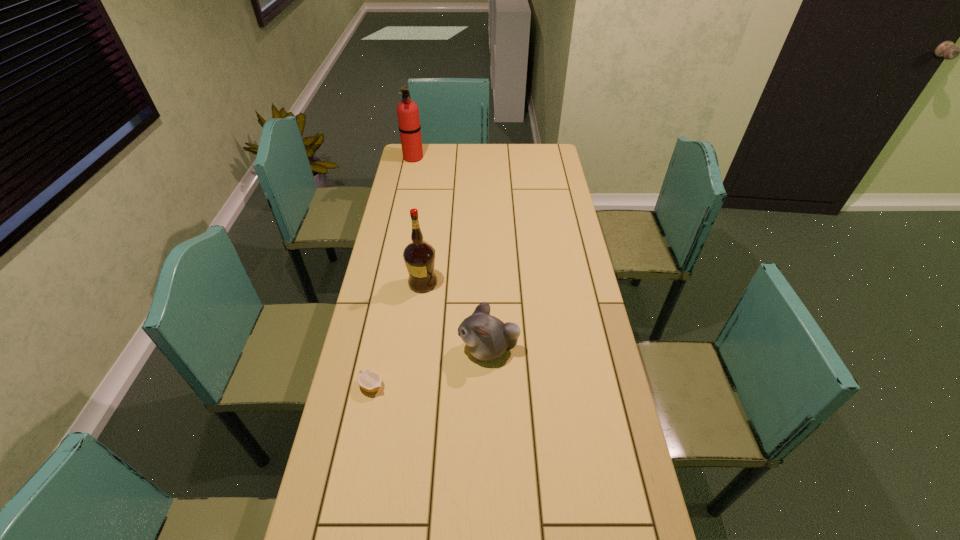
The width and height of the screenshot is (960, 540). I want to click on vacant area at the right edge of the desktop, so click(x=551, y=170).

I want to click on vacant space at the far left corner of the desktop, so click(429, 151).

Locate an element on the screen. The image size is (960, 540). free location at the far right corner of the desktop is located at coordinates pyautogui.click(x=536, y=148).

The width and height of the screenshot is (960, 540). I want to click on free space between the farthest object and the hamster, so click(451, 253).

Image resolution: width=960 pixels, height=540 pixels. I want to click on vacant point located between the second farthest object and the second nearest object, so click(456, 316).

This screenshot has width=960, height=540. I want to click on vacant area between the alcohol and the lemon, so click(397, 334).

In order to click on vacant point located between the alcohol and the nearest object in this screenshot , I will do `click(397, 334)`.

Find the location of a particular element. free spot between the third object from left to right and the rightmost object is located at coordinates [456, 316].

I want to click on vacant area that lies between the shortest object and the hamster, so click(x=430, y=368).

Locate an element on the screen. free space between the third nearest object and the shortest object is located at coordinates (397, 334).